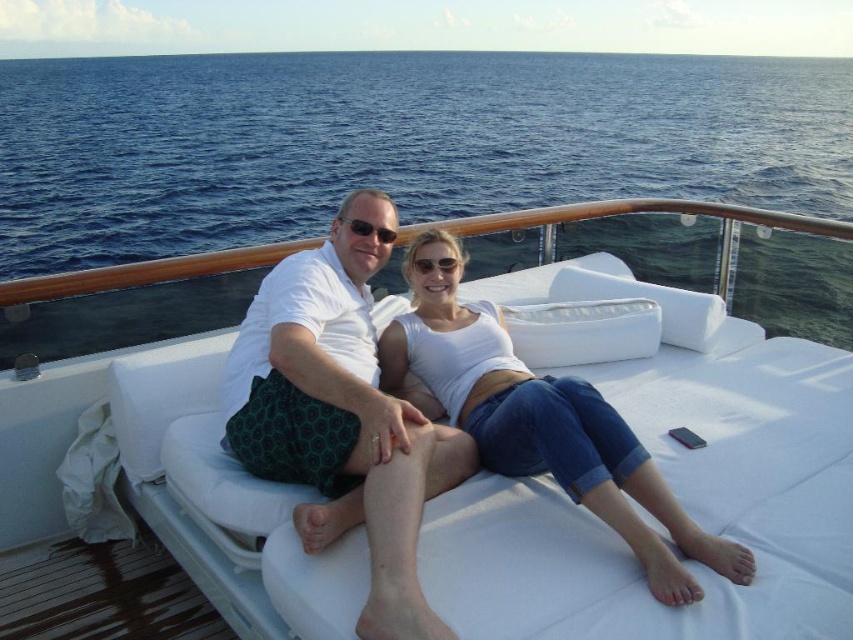
Question: Considering the real-world distances, which object is farthest from the white cotton tank top at center?

Choices:
 (A) white cushioned couch at center
 (B) matte black sunglasses at upper center
 (C) white cotton shirt at center

Answer: (A)

Question: Estimate the real-world distances between objects in this image. Which object is farther from the white cushioned couch at center?

Choices:
 (A) white cotton tank top at center
 (B) denim at center
 (C) blue water at center
 (D) matte black sunglasses at upper center

Answer: (C)

Question: Does white cotton tank top at center have a smaller size compared to matte black sunglasses at upper center?

Choices:
 (A) yes
 (B) no

Answer: (B)

Question: Does blue water at center lie in front of transparent plastic sunglasses at center?

Choices:
 (A) no
 (B) yes

Answer: (A)

Question: Which object is farther from the camera taking this photo?

Choices:
 (A) denim at center
 (B) matte black sunglasses at upper center
 (C) white cotton shirt at center
 (D) white cushioned couch at center

Answer: (B)

Question: Can you confirm if blue water at center is positioned below transparent plastic sunglasses at center?

Choices:
 (A) no
 (B) yes

Answer: (A)